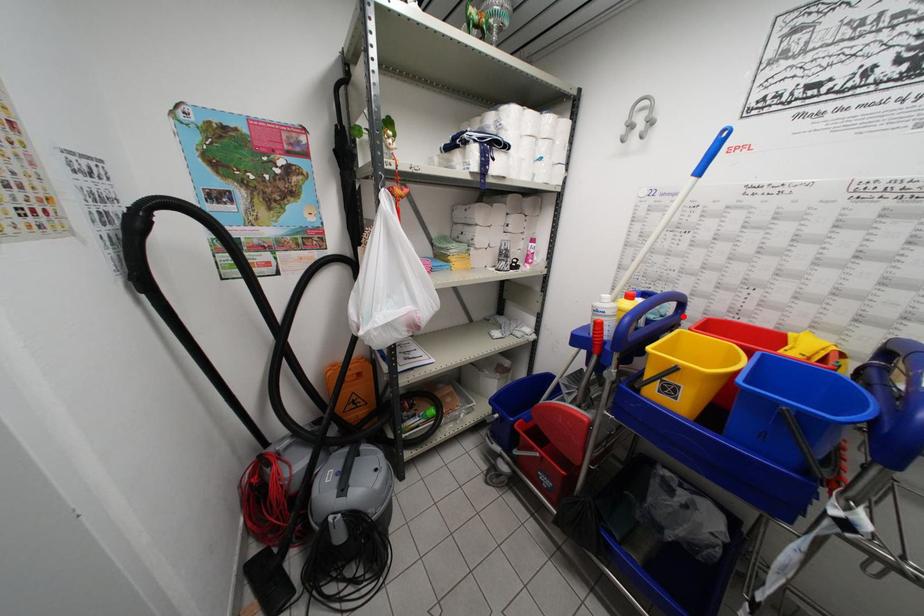
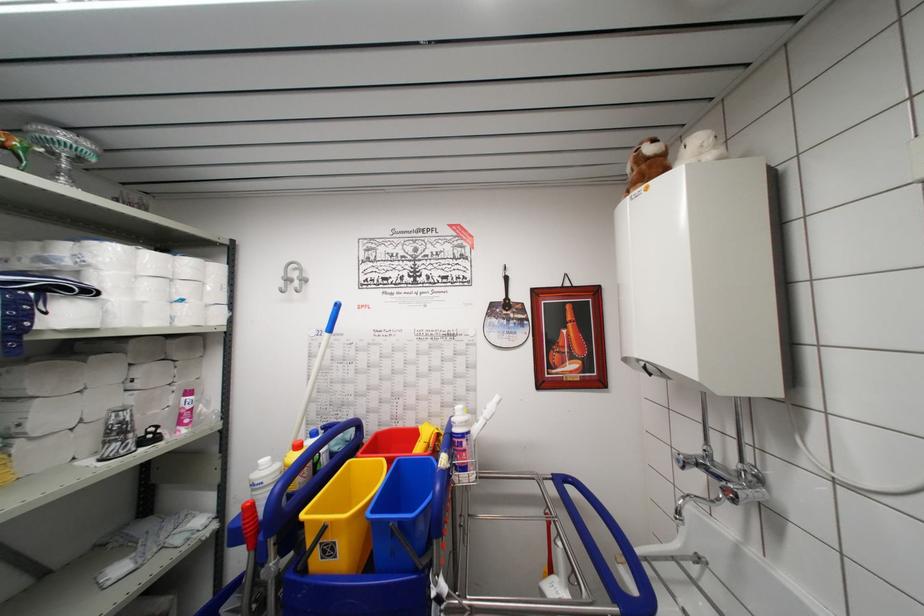
Question: I am providing you with two images of the same scene from different viewpoints. A red point is marked on the first image. Can you still see the location of the red point in image 2?

Choices:
 (A) Yes
 (B) No

Answer: (A)